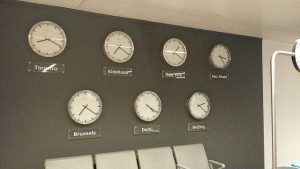
At what (x,y) coordinates should I click in order to perform the action: click on clock face. Please return your answer as a coordinate pair (x, y). This screenshot has height=169, width=300. Looking at the image, I should click on [147, 110].